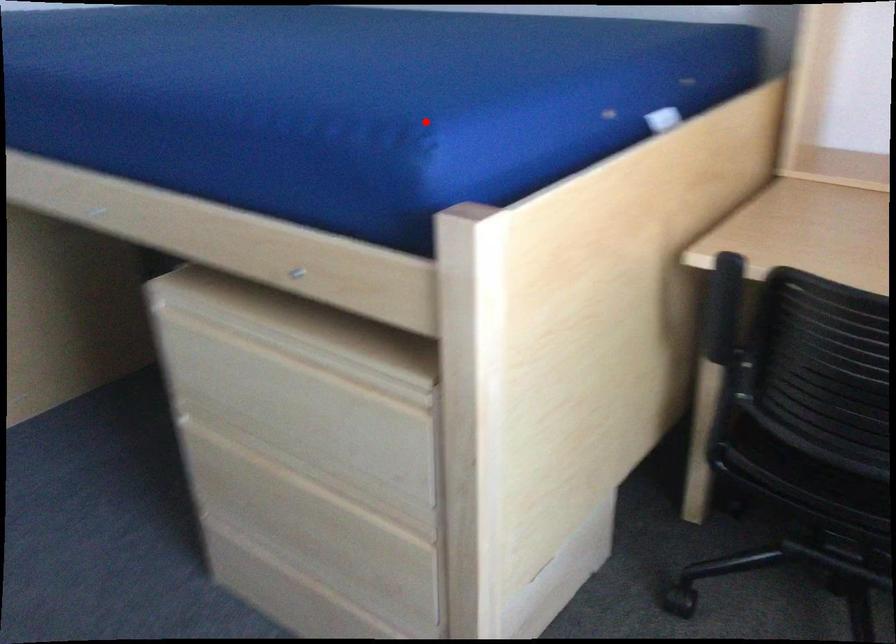
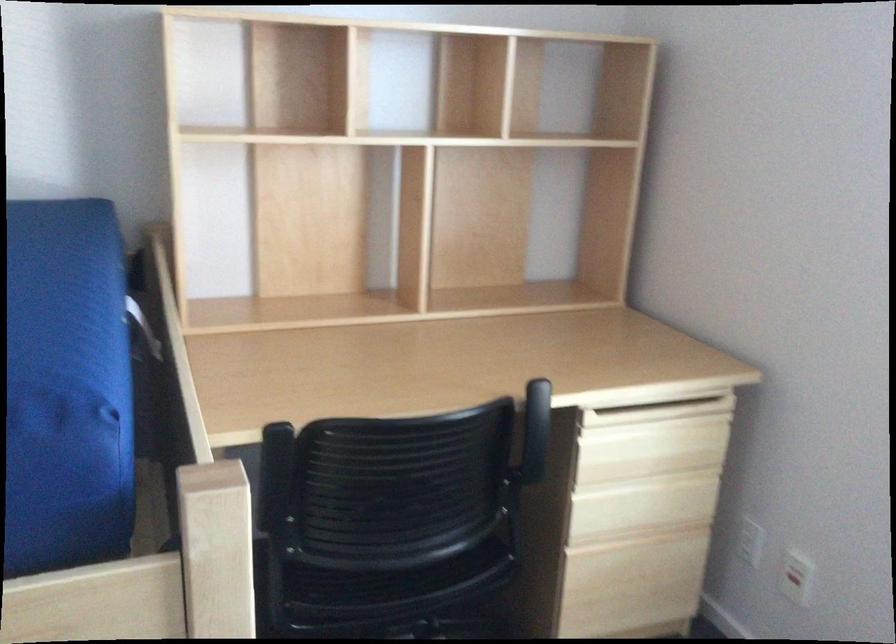
Question: I am providing you with two images of the same scene from different viewpoints. A red point is shown in image1. For the corresponding object point in image2, is it positioned nearer or farther from the camera?

Choices:
 (A) Nearer
 (B) Farther

Answer: (A)